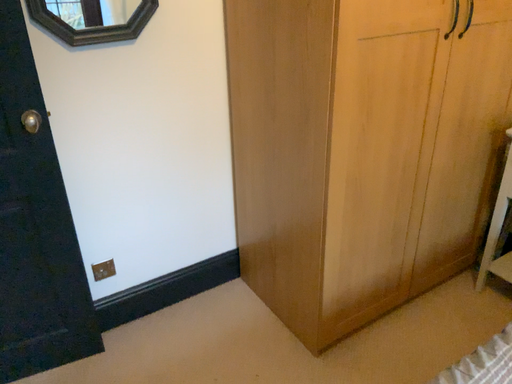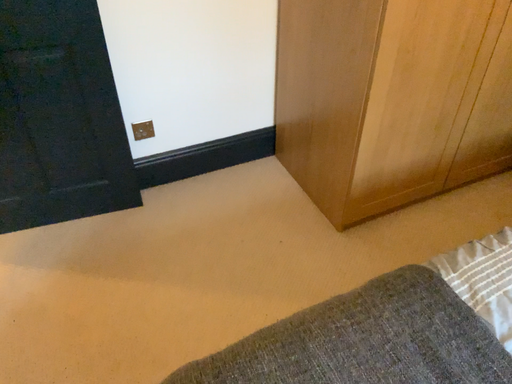
Question: Which way did the camera rotate in the video?

Choices:
 (A) rotated upward
 (B) rotated downward

Answer: (B)